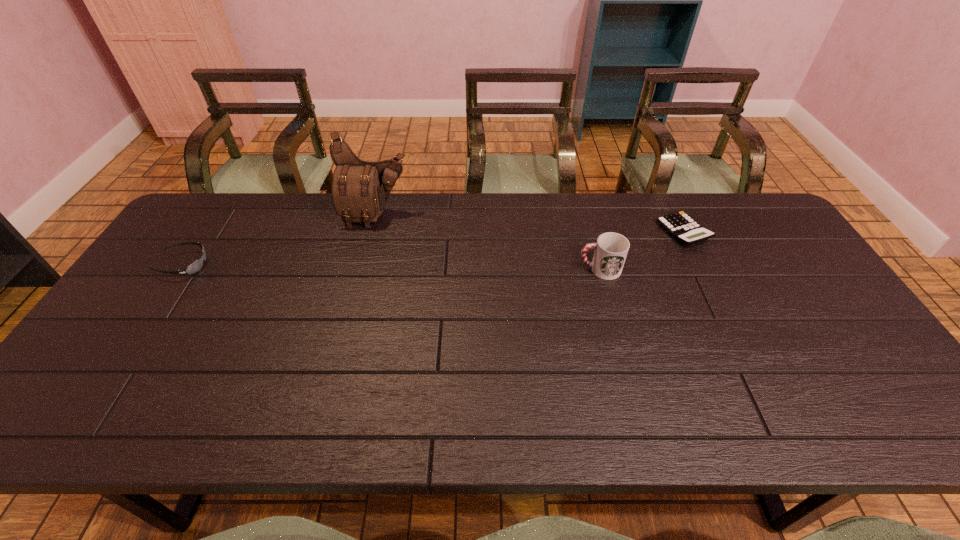
The height and width of the screenshot is (540, 960). I want to click on free space between the second object from right to left and the rightmost object, so click(x=641, y=251).

Image resolution: width=960 pixels, height=540 pixels. I want to click on empty location between the shortest object and the tallest object, so click(x=529, y=224).

Identify which object is the second closest to the shortest object. Please provide its 2D coordinates. Your answer should be formatted as a tuple, i.e. [(x, y)], where the tuple contains the x and y coordinates of a point satisfying the conditions above.

[(360, 189)]

Identify the location of object that is the closest to the leftmost object. The width and height of the screenshot is (960, 540). pyautogui.click(x=360, y=189).

At what (x,y) coordinates should I click in order to perform the action: click on vacant region that satisfies the following two spatial constraints: 1. on the lenses of the leftmost object; 2. on the handle side of the cup. Please return your answer as a coordinate pair (x, y). The height and width of the screenshot is (540, 960). Looking at the image, I should click on (181, 269).

Where is `vacant space that satisfies the following two spatial constraints: 1. on the front-facing side of the second object from left to right; 2. on the handle side of the cup`? vacant space that satisfies the following two spatial constraints: 1. on the front-facing side of the second object from left to right; 2. on the handle side of the cup is located at coordinates (362, 269).

I want to click on vacant space that satisfies the following two spatial constraints: 1. on the handle side of the third object from left to right; 2. on the lenses of the third tallest object, so click(598, 265).

Find the location of a particular element. The width and height of the screenshot is (960, 540). free spot that satisfies the following two spatial constraints: 1. on the lenses of the third tallest object; 2. on the handle side of the cup is located at coordinates (181, 269).

At what (x,y) coordinates should I click in order to perform the action: click on vacant area in the image that satisfies the following two spatial constraints: 1. on the front-facing side of the third object from right to left; 2. on the lenses of the leftmost object. Please return your answer as a coordinate pair (x, y). Looking at the image, I should click on (363, 265).

Find the location of a particular element. blank area in the image that satisfies the following two spatial constraints: 1. on the front-facing side of the tallest object; 2. on the handle side of the cup is located at coordinates pos(362,269).